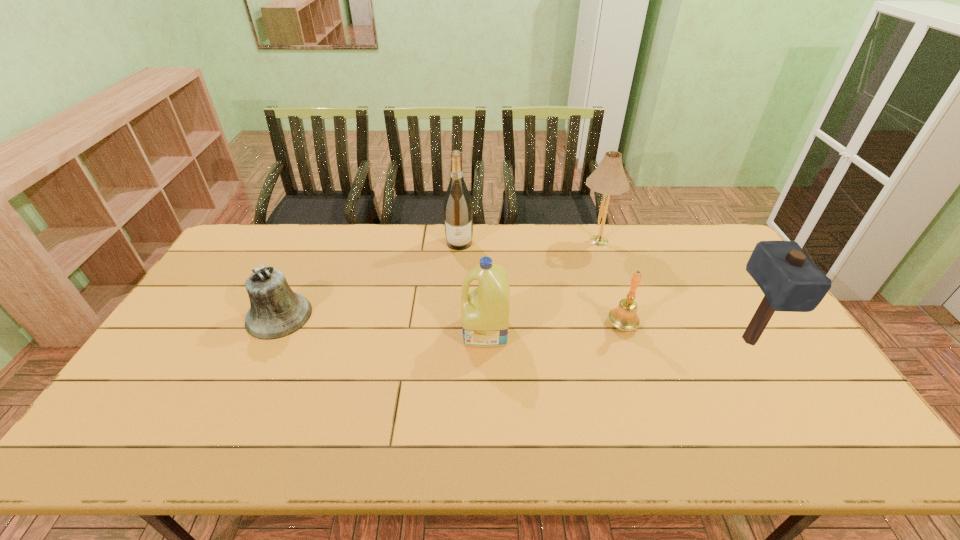
At what (x,y) coordinates should I click in order to perform the action: click on free space between the wine bottle and the left bell. Please return your answer as a coordinate pair (x, y). Image resolution: width=960 pixels, height=540 pixels. Looking at the image, I should click on (370, 279).

Locate an element on the screen. The image size is (960, 540). free space between the lampshade and the right bell is located at coordinates (609, 283).

Identify the location of vacant space in between the left bell and the right bell. (450, 320).

Identify which object is the fifth closest to the right bell. Please provide its 2D coordinates. Your answer should be formatted as a tuple, i.e. [(x, y)], where the tuple contains the x and y coordinates of a point satisfying the conditions above.

[(276, 311)]

Where is `object that can be found as the fourth closest to the leftmost object`? The image size is (960, 540). object that can be found as the fourth closest to the leftmost object is located at coordinates (608, 178).

At what (x,y) coordinates should I click in order to perform the action: click on free spot that satisfies the following two spatial constraints: 1. on the label of the third shortest object; 2. on the left side of the rightmost object. Please return your answer as a coordinate pair (x, y). Looking at the image, I should click on (486, 339).

You are a GUI agent. You are given a task and a screenshot of the screen. Output one action in this format:
    pyautogui.click(x=<x>, y=<y>)
    Task: Click on the free point that satisfies the following two spatial constraints: 1. on the back side of the leftmost object; 2. on the left side of the lampshade
    This screenshot has height=540, width=960.
    Given the screenshot: What is the action you would take?
    pyautogui.click(x=314, y=241)

Image resolution: width=960 pixels, height=540 pixels. In order to click on vacant area in the image that satisfies the following two spatial constraints: 1. on the label of the right bell; 2. on the right side of the wine bottle in this screenshot , I will do `click(454, 325)`.

At what (x,y) coordinates should I click in order to perform the action: click on vacant point that satisfies the following two spatial constraints: 1. on the front side of the right bell; 2. on the right side of the leftmost object. Please return your answer as a coordinate pair (x, y). The width and height of the screenshot is (960, 540). Looking at the image, I should click on (275, 325).

Where is `free space that satisfies the following two spatial constraints: 1. on the label of the wine bottle; 2. on the left side of the right bell`? Image resolution: width=960 pixels, height=540 pixels. free space that satisfies the following two spatial constraints: 1. on the label of the wine bottle; 2. on the left side of the right bell is located at coordinates (454, 325).